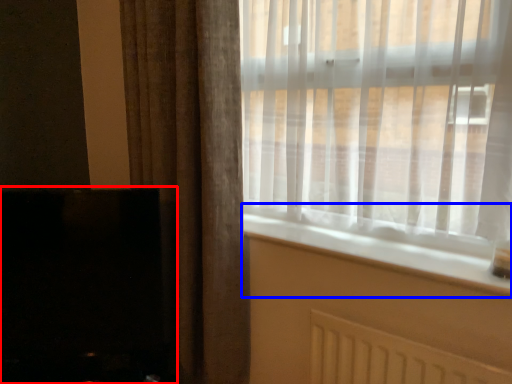
Question: Among these objects, which one is nearest to the camera, fireplace (highlighted by a red box) or window sill (highlighted by a blue box)?

Choices:
 (A) fireplace
 (B) window sill

Answer: (B)